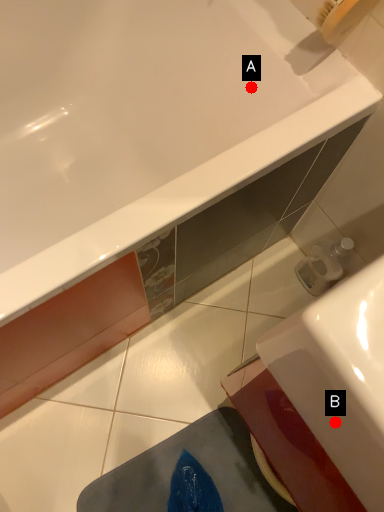
Question: Two points are circled on the image, labeled by A and B beside each circle. Among these points, which one is nearest to the camera?

Choices:
 (A) A is closer
 (B) B is closer

Answer: (B)